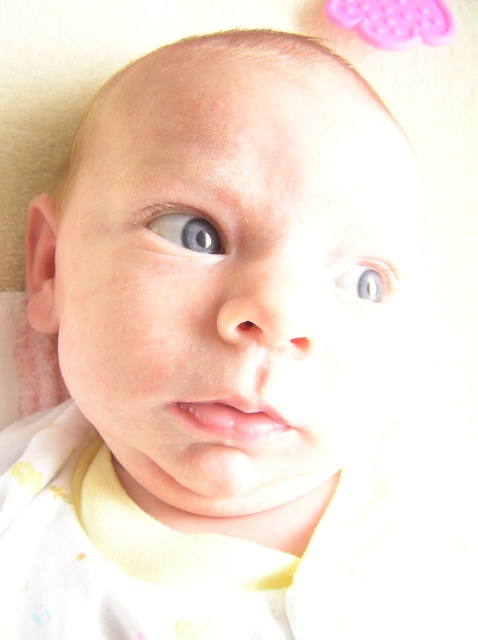
You are a photographer adjusting the lighting for a baby photo shoot. You notice a blue glossy eye at upper left located at point (x=187, y=230). To ensure the reflection in the eye is properly captured, where should you position the light source relative to the camera and the baby?

The blue glossy eye at upper left is located at point (x=187, y=230). To capture the reflection properly, position the light source above and to the left of the camera, ensuring it aligns with the direction of the baby to create a catchlight in the eye.